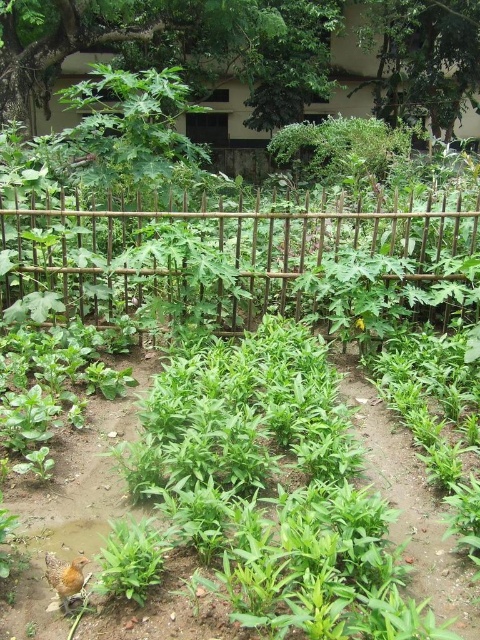
You are standing in the garden and see two points marked on the ground. The first point is at coordinates point [141,228] and the second point is at point [340,355]. Which point is closer to you?

Point [141,228] is in front of point [340,355], so it is closer to you.

You are a gardener standing at the entrance of the garden. You see the brown metal fence at center and the green leafy plants at center. Which object is closer to your left side?

The brown metal fence at center is to the left of green leafy plants at center, so the brown metal fence at center is closer to your left side.